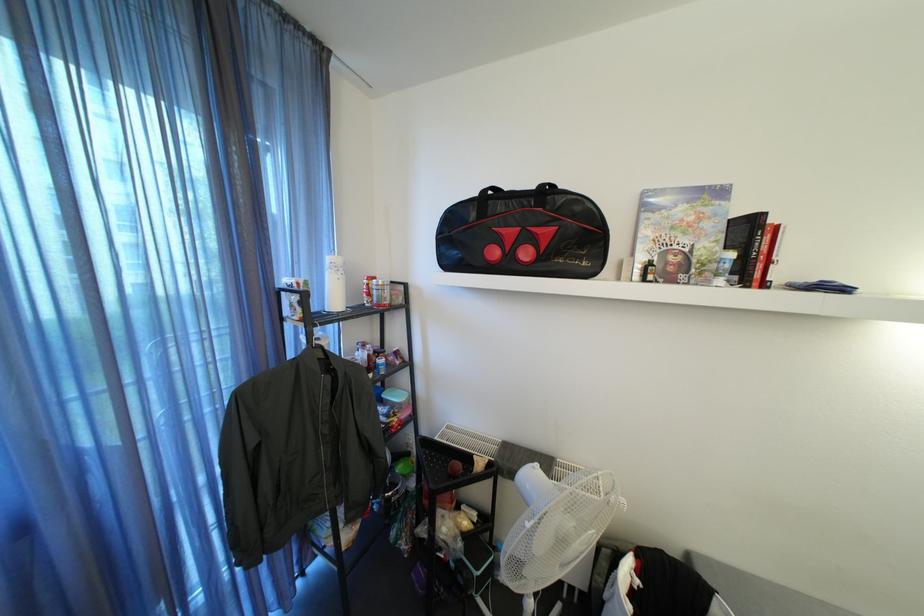
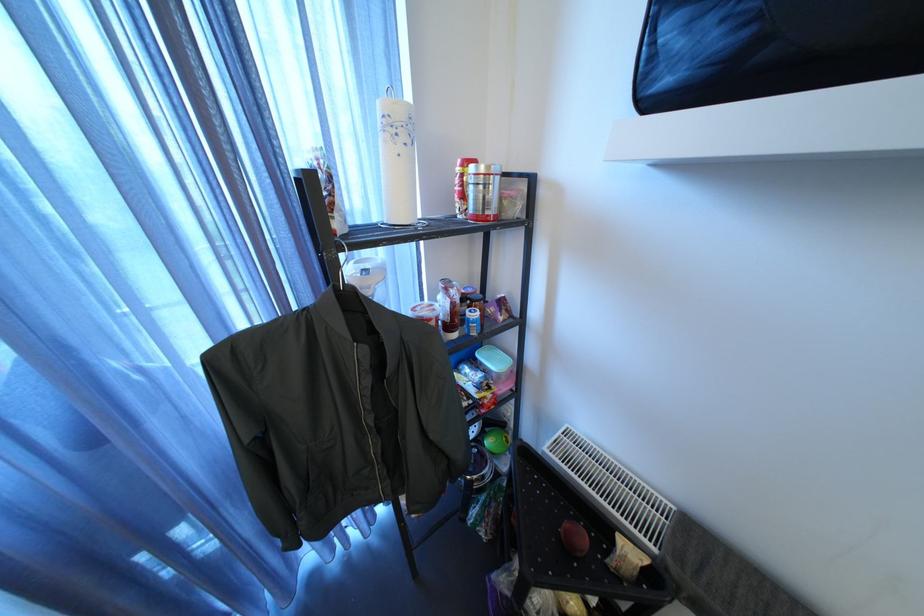
How did the camera likely rotate?

The camera rotated toward left-down.